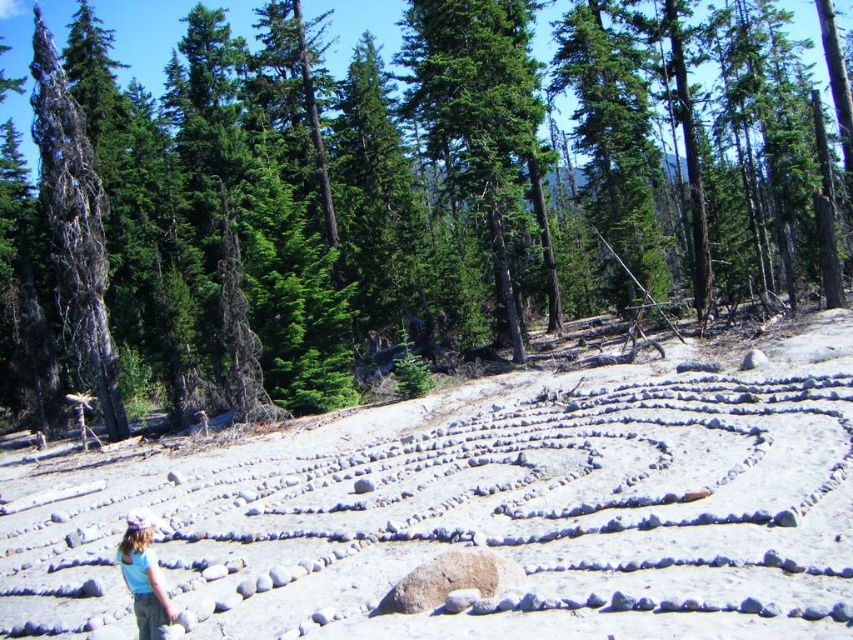
Is green glossy tree at center thinner than light blue t-shirt at lower left?

No.

Can you confirm if green glossy tree at center is positioned to the right of light blue t-shirt at lower left?

Correct, you'll find green glossy tree at center to the right of light blue t-shirt at lower left.

Is point (529, 125) behind point (161, 584)?

Yes, point (529, 125) is farther from viewer.

The image size is (853, 640). I want to click on green glossy tree at center, so click(x=485, y=125).

Does green evergreen tree at center come behind light blue t-shirt at lower left?

Yes, green evergreen tree at center is behind light blue t-shirt at lower left.

Does green evergreen tree at center have a lesser height compared to light blue t-shirt at lower left?

No, green evergreen tree at center is not shorter than light blue t-shirt at lower left.

Find the location of a particular element. green evergreen tree at center is located at coordinates tap(396, 195).

Is green evergreen tree at center bigger than green glossy tree at center?

Yes.

In the scene shown: Does green evergreen tree at center have a greater width compared to green glossy tree at center?

Yes, green evergreen tree at center is wider than green glossy tree at center.

Between point (357, 147) and point (527, 45), which one is positioned in front?

Positioned in front is point (527, 45).

Where is `green evergreen tree at center`? green evergreen tree at center is located at coordinates (396, 195).